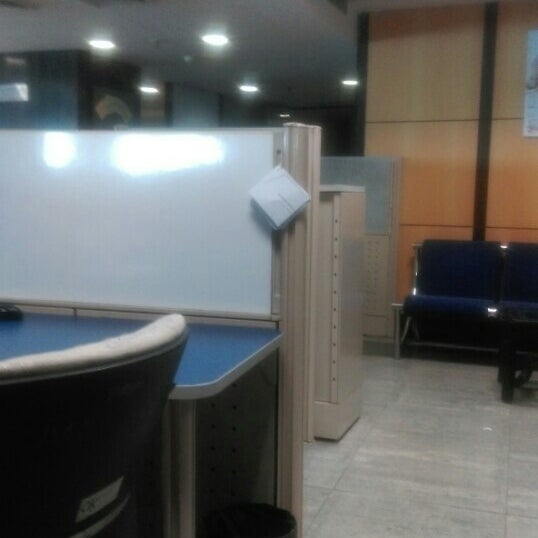
Where is `white board`? This screenshot has width=538, height=538. white board is located at coordinates (206, 249).